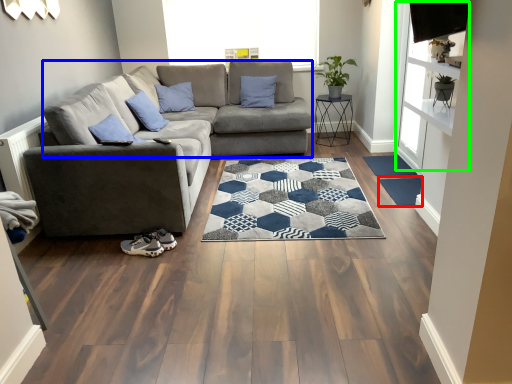
Question: Which object is the farthest from doormat (highlighted by a red box)? Choose among these: couch (highlighted by a blue box) or window screen (highlighted by a green box).

Choices:
 (A) couch
 (B) window screen

Answer: (A)